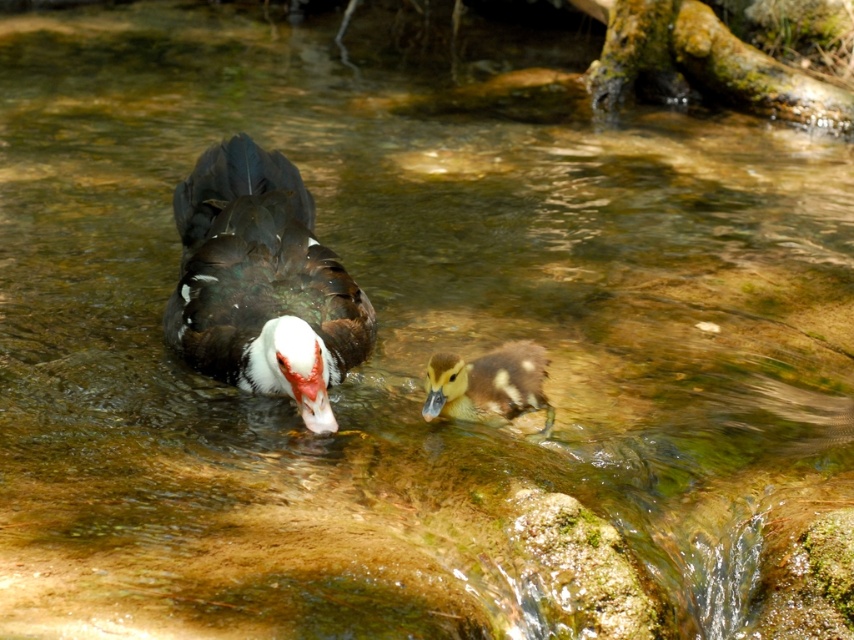
Question: In this image, where is black glossy duck at center located relative to brown speckled duckling at center?

Choices:
 (A) above
 (B) below

Answer: (A)

Question: Among these objects, which one is farthest from the camera?

Choices:
 (A) brown speckled duckling at center
 (B) black glossy duck at center

Answer: (A)

Question: Can you confirm if black glossy duck at center is bigger than brown speckled duckling at center?

Choices:
 (A) yes
 (B) no

Answer: (A)

Question: Which point is farther to the camera?

Choices:
 (A) black glossy duck at center
 (B) brown speckled duckling at center

Answer: (B)

Question: Can you confirm if black glossy duck at center is positioned to the left of brown speckled duckling at center?

Choices:
 (A) yes
 (B) no

Answer: (A)